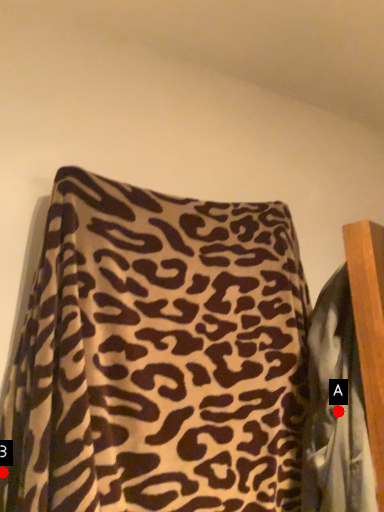
Question: Two points are circled on the image, labeled by A and B beside each circle. Which point is farther to the camera?

Choices:
 (A) A is further
 (B) B is further

Answer: (A)